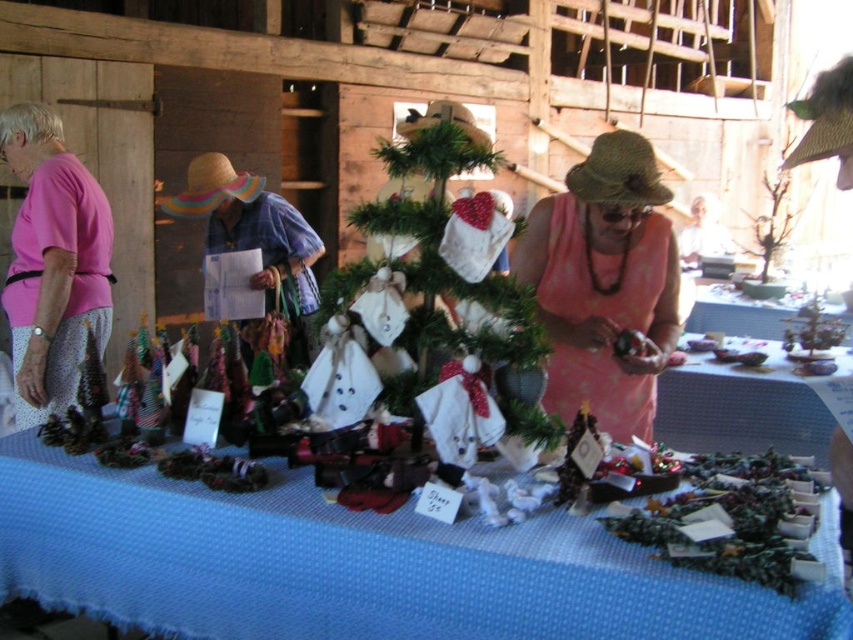
You are standing at the entrance of the barn and want to reach the point closer to you between point (548, 404) and point (773, 323). Which point should you head towards?

Point (548, 404) is in front of point (773, 323), so you should head towards point (548, 404) as it is closer to you.

You are a customer at a craft fair and want to pick up an item from the blue woven tablecloth at center and the metallic silver tray at center. Which one is easier to reach without moving your current position?

The blue woven tablecloth at center is closer to the viewer than the metallic silver tray at center, so it is easier to reach without moving.